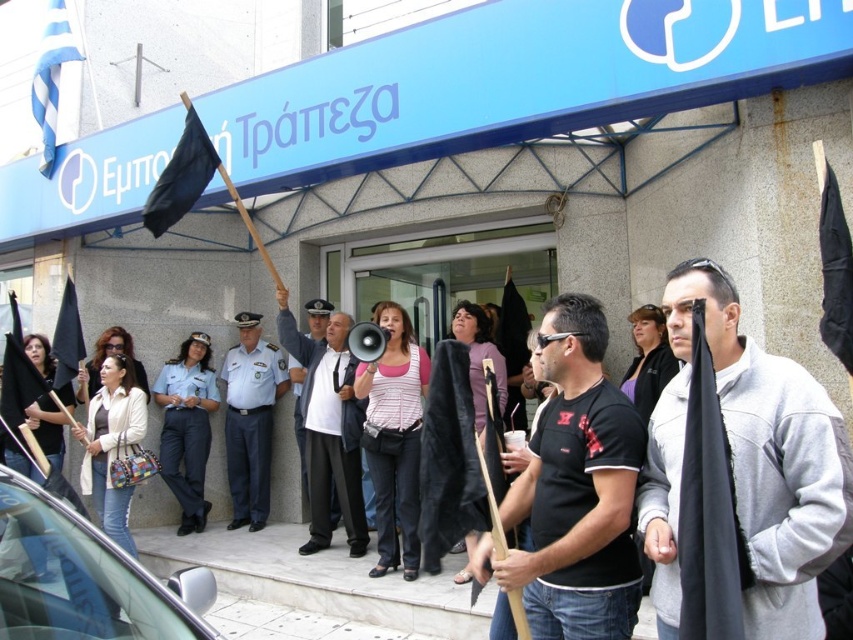
Question: Among these points, which one is farthest from the camera?

Choices:
 (A) (845, 513)
 (B) (283, 300)
 (C) (59, 332)
 (D) (144, 205)

Answer: (C)

Question: Considering the real-world distances, which object is closest to the blue and white striped fabric at upper left?

Choices:
 (A) gray matte jacket at center
 (B) black fabric flag at upper left

Answer: (B)

Question: Is white shirt at center above light blue uniform at center?

Choices:
 (A) yes
 (B) no

Answer: (A)

Question: Can you confirm if black matte shirt at center is positioned to the right of white shirt at center?

Choices:
 (A) no
 (B) yes

Answer: (B)

Question: Does black matte shirt at center have a smaller size compared to black fabric flag at left?

Choices:
 (A) yes
 (B) no

Answer: (B)

Question: Which point is farther to the camera?

Choices:
 (A) (692, 275)
 (B) (560, 404)
 (C) (57, 314)

Answer: (C)